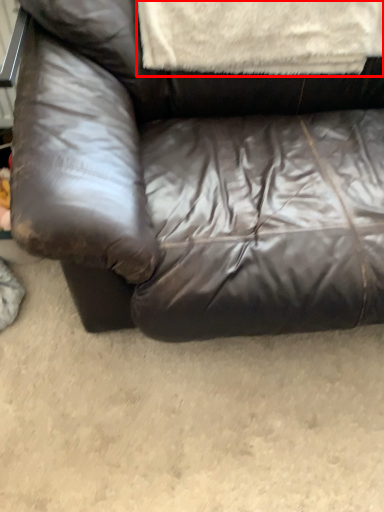
Question: Where is blanket (annotated by the red box) located in relation to studio couch in the image?

Choices:
 (A) left
 (B) right

Answer: (A)